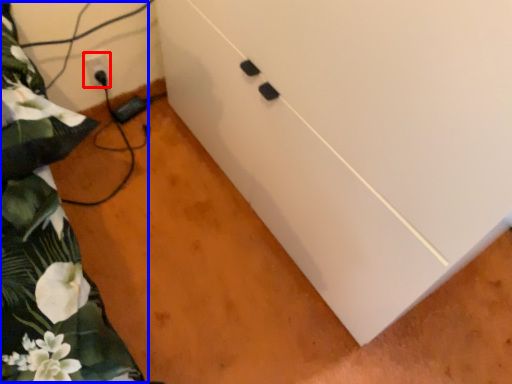
Question: Which object is closer to the camera taking this photo, electric outlet (highlighted by a red box) or bed (highlighted by a blue box)?

Choices:
 (A) electric outlet
 (B) bed

Answer: (B)